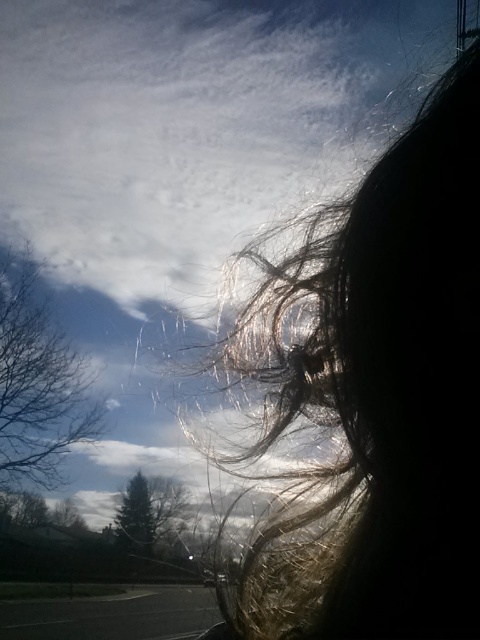
You are a photographer trying to capture a shot of the silky brown hair at upper right and the bare branches at left. Based on their sizes in the image, which object would you focus on first to ensure it is in sharp focus?

The bare branches at left occupy more space in the image than the silky brown hair at upper right, so focusing on the bare branches at left first would ensure they are in sharp focus.

Based on the scene described, which object, the bare branches at left or the green matte tree at lower left, has a greater width when observed from the perspective of someone standing in front of them?

The bare branches at left might be wider than green matte tree at lower left according to the description.